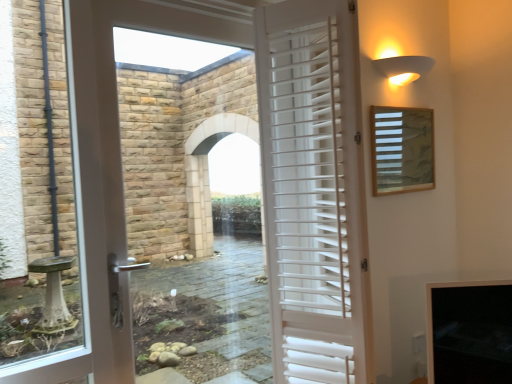
Question: Is white matte wall sconce at upper right beside white wooden shutters at center?

Choices:
 (A) no
 (B) yes

Answer: (A)

Question: Does white matte wall sconce at upper right lie in front of white wooden shutters at center?

Choices:
 (A) yes
 (B) no

Answer: (B)

Question: Is white matte wall sconce at upper right bigger than white wooden shutters at center?

Choices:
 (A) no
 (B) yes

Answer: (A)

Question: Can you confirm if white matte wall sconce at upper right is smaller than white wooden shutters at center?

Choices:
 (A) no
 (B) yes

Answer: (B)

Question: Is white matte wall sconce at upper right outside white wooden shutters at center?

Choices:
 (A) no
 (B) yes

Answer: (B)

Question: In the image, is wooden slats at upper right positioned in front of or behind white wooden shutters at center?

Choices:
 (A) front
 (B) behind

Answer: (B)

Question: From the image's perspective, relative to white wooden shutters at center, is wooden slats at upper right above or below?

Choices:
 (A) above
 (B) below

Answer: (A)

Question: Does point (408, 137) appear closer or farther from the camera than point (304, 152)?

Choices:
 (A) farther
 (B) closer

Answer: (A)

Question: Based on their positions, is wooden slats at upper right located to the left or right of white wooden shutters at center?

Choices:
 (A) right
 (B) left

Answer: (A)

Question: Is point (340, 11) closer or farther from the camera than point (394, 66)?

Choices:
 (A) farther
 (B) closer

Answer: (B)

Question: From their relative heights in the image, would you say white wooden shutters at center is taller or shorter than white matte wall sconce at upper right?

Choices:
 (A) tall
 (B) short

Answer: (A)

Question: From a real-world perspective, relative to white matte wall sconce at upper right, is white wooden shutters at center vertically above or below?

Choices:
 (A) above
 (B) below

Answer: (B)

Question: Looking at their shapes, would you say white wooden shutters at center is wider or thinner than white matte wall sconce at upper right?

Choices:
 (A) thin
 (B) wide

Answer: (B)

Question: Does point (408, 122) appear closer or farther from the camera than point (410, 71)?

Choices:
 (A) farther
 (B) closer

Answer: (A)

Question: Is wooden slats at upper right spatially inside white matte wall sconce at upper right, or outside of it?

Choices:
 (A) inside
 (B) outside

Answer: (B)